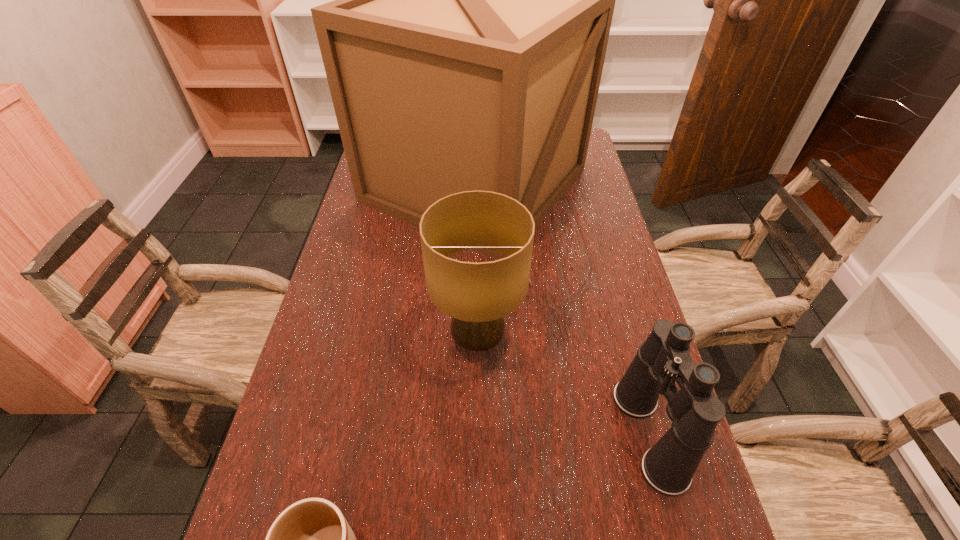
Image resolution: width=960 pixels, height=540 pixels. I want to click on the tallest object, so click(x=473, y=0).

The width and height of the screenshot is (960, 540). Find the location of `box`. box is located at coordinates (473, 0).

You are a GUI agent. You are given a task and a screenshot of the screen. Output one action in this format:
    pyautogui.click(x=<x>, y=<y>)
    Task: Click on the second farthest object
    
    Given the screenshot: What is the action you would take?
    (477, 296)

The height and width of the screenshot is (540, 960). I want to click on lampshade, so click(477, 296).

The height and width of the screenshot is (540, 960). Identify the location of the second nearest object. (664, 358).

The image size is (960, 540). I want to click on binoculars, so click(664, 358).

The image size is (960, 540). In order to click on vacant space located on the front of the box in this screenshot , I will do `click(473, 299)`.

This screenshot has height=540, width=960. In order to click on vacant point located on the back of the third nearest object in this screenshot , I will do `click(478, 252)`.

Where is `vacant space situated 0.200m on the back of the third farthest object`? vacant space situated 0.200m on the back of the third farthest object is located at coordinates (614, 310).

Find the location of `object at the far edge`. object at the far edge is located at coordinates (x=473, y=0).